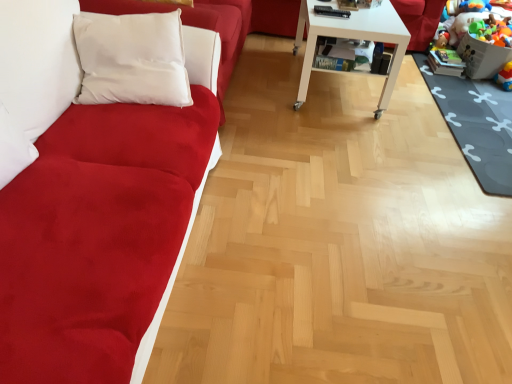
The image size is (512, 384). What do you see at coordinates (505, 77) in the screenshot?
I see `rubberized plastic toy at lower right, which appears as the first toy when ordered from the bottom` at bounding box center [505, 77].

The height and width of the screenshot is (384, 512). What do you see at coordinates (103, 231) in the screenshot? I see `suede-like red couch at left` at bounding box center [103, 231].

Identify the location of dark gray rubber mat at lower right. This screenshot has height=384, width=512. (476, 124).

This screenshot has height=384, width=512. I want to click on plush multicolored toys at lower right, acting as the 1th toy starting from the top, so click(481, 40).

Where is `white glossy table at center`? The image size is (512, 384). white glossy table at center is located at coordinates (352, 38).

This screenshot has width=512, height=384. I want to click on rubberized plastic toy at lower right, which is counted as the second toy, starting from the top, so click(x=505, y=77).

Considering the sizes of objects suede-like red couch at left and white glossy table at center in the image provided, who is bigger, suede-like red couch at left or white glossy table at center?

Bigger between the two is suede-like red couch at left.

Is suede-like red couch at left placed right next to white glossy table at center?

No, suede-like red couch at left is not next to white glossy table at center.

Which is behind, suede-like red couch at left or white glossy table at center?

white glossy table at center is more distant.

From a real-world perspective, is plush multicolored toys at lower right, acting as the second toy starting from the bottom, physically below dark gray rubber mat at lower right?

No.

Which object is closer to the camera, plush multicolored toys at lower right, acting as the 1th toy starting from the top, or dark gray rubber mat at lower right?

dark gray rubber mat at lower right is more forward.

Considering the relative sizes of plush multicolored toys at lower right, acting as the second toy starting from the bottom, and dark gray rubber mat at lower right in the image provided, is plush multicolored toys at lower right, acting as the second toy starting from the bottom, smaller than dark gray rubber mat at lower right?

Yes, plush multicolored toys at lower right, acting as the second toy starting from the bottom, is smaller than dark gray rubber mat at lower right.

Which object is thinner, plush multicolored toys at lower right, acting as the 1th toy starting from the top, or dark gray rubber mat at lower right?

plush multicolored toys at lower right, acting as the 1th toy starting from the top, is thinner.

Does dark gray rubber mat at lower right turn towards white glossy table at center?

No, dark gray rubber mat at lower right is not oriented towards white glossy table at center.

Looking at this image, from the image's perspective, between dark gray rubber mat at lower right and white glossy table at center, who is located below?

From the image's view, dark gray rubber mat at lower right is below.

Between dark gray rubber mat at lower right and white glossy table at center, which one has less height?

dark gray rubber mat at lower right is shorter.

Image resolution: width=512 pixels, height=384 pixels. Find the location of `mat below the white glossy table at center (from the image's perspective)`. mat below the white glossy table at center (from the image's perspective) is located at coordinates (476, 124).

From the image's perspective, is suede-like red couch at left below rubberized plastic toy at lower right, which appears as the first toy when ordered from the bottom?

Yes, from the image's perspective, suede-like red couch at left is below rubberized plastic toy at lower right, which appears as the first toy when ordered from the bottom.

Between suede-like red couch at left and rubberized plastic toy at lower right, which appears as the first toy when ordered from the bottom, which one has larger size?

suede-like red couch at left is bigger.

Considering the relative positions of suede-like red couch at left and rubberized plastic toy at lower right, which is counted as the second toy, starting from the top, in the image provided, is suede-like red couch at left behind rubberized plastic toy at lower right, which is counted as the second toy, starting from the top,?

No, suede-like red couch at left is in front of rubberized plastic toy at lower right, which is counted as the second toy, starting from the top.

How different are the orientations of plush multicolored toys at lower right, acting as the second toy starting from the bottom, and white glossy table at center in degrees?

17.2 degrees separate the facing orientations of plush multicolored toys at lower right, acting as the second toy starting from the bottom, and white glossy table at center.

Is plush multicolored toys at lower right, acting as the second toy starting from the bottom, in contact with white glossy table at center?

There is a gap between plush multicolored toys at lower right, acting as the second toy starting from the bottom, and white glossy table at center.

From a real-world perspective, is plush multicolored toys at lower right, acting as the 1th toy starting from the top, below white glossy table at center?

Indeed, from a real-world perspective, plush multicolored toys at lower right, acting as the 1th toy starting from the top, is positioned beneath white glossy table at center.

In the scene shown: Is plush multicolored toys at lower right, acting as the 1th toy starting from the top, touching suede-like red couch at left?

There is a gap between plush multicolored toys at lower right, acting as the 1th toy starting from the top, and suede-like red couch at left.

From the image's perspective, which one is positioned higher, plush multicolored toys at lower right, acting as the second toy starting from the bottom, or suede-like red couch at left?

From the image's view, plush multicolored toys at lower right, acting as the second toy starting from the bottom, is above.

Is plush multicolored toys at lower right, acting as the second toy starting from the bottom, inside the boundaries of suede-like red couch at left, or outside?

plush multicolored toys at lower right, acting as the second toy starting from the bottom, cannot be found inside suede-like red couch at left.

This screenshot has width=512, height=384. What are the coordinates of `toy that is the 1st object to the right of the suede-like red couch at left, starting at the anchor` in the screenshot? It's located at (481, 40).

Is white glossy table at center closer to camera compared to suede-like red couch at left?

No, it is not.

Is suede-like red couch at left a part of white glossy table at center?

No, suede-like red couch at left is not surrounded by white glossy table at center.

Is point (367, 39) behind point (130, 298)?

Yes, it is behind point (130, 298).

Where is `studio couch below the white glossy table at center (from the image's perspective)`? This screenshot has width=512, height=384. studio couch below the white glossy table at center (from the image's perspective) is located at coordinates (103, 231).

This screenshot has width=512, height=384. I want to click on studio couch below the white glossy table at center (from the image's perspective), so click(103, 231).

Where is `the 2nd toy above the dark gray rubber mat at lower right (from the image's perspective)`? Image resolution: width=512 pixels, height=384 pixels. the 2nd toy above the dark gray rubber mat at lower right (from the image's perspective) is located at coordinates (481, 40).

Looking at the image, which one is located closer to white glossy table at center, dark gray rubber mat at lower right or rubberized plastic toy at lower right, which appears as the first toy when ordered from the bottom?

dark gray rubber mat at lower right is closer to white glossy table at center.

Looking at the image, which one is located further to plush multicolored toys at lower right, acting as the 1th toy starting from the top, dark gray rubber mat at lower right or suede-like red couch at left?

Based on the image, suede-like red couch at left appears to be further to plush multicolored toys at lower right, acting as the 1th toy starting from the top.

Considering their positions, is plush multicolored toys at lower right, acting as the 1th toy starting from the top, positioned further to dark gray rubber mat at lower right than white glossy table at center?

white glossy table at center lies further to dark gray rubber mat at lower right than the other object.

Considering their positions, is white glossy table at center positioned closer to dark gray rubber mat at lower right than suede-like red couch at left?

Among the two, white glossy table at center is located nearer to dark gray rubber mat at lower right.

Based on the photo, based on their spatial positions, is rubberized plastic toy at lower right, which is counted as the second toy, starting from the top, or suede-like red couch at left further from white glossy table at center?

Among the two, suede-like red couch at left is located further to white glossy table at center.

Considering their positions, is rubberized plastic toy at lower right, which is counted as the second toy, starting from the top, positioned closer to dark gray rubber mat at lower right than white glossy table at center?

Based on the image, rubberized plastic toy at lower right, which is counted as the second toy, starting from the top, appears to be nearer to dark gray rubber mat at lower right.

From the image, which object appears to be farther from rubberized plastic toy at lower right, which is counted as the second toy, starting from the top, suede-like red couch at left or plush multicolored toys at lower right, acting as the second toy starting from the bottom?

suede-like red couch at left.

When comparing their distances from suede-like red couch at left, does plush multicolored toys at lower right, acting as the 1th toy starting from the top, or dark gray rubber mat at lower right seem closer?

Based on the image, dark gray rubber mat at lower right appears to be nearer to suede-like red couch at left.

The height and width of the screenshot is (384, 512). In order to click on table located between suede-like red couch at left and dark gray rubber mat at lower right in the left-right direction in this screenshot , I will do `click(352, 38)`.

You are a GUI agent. You are given a task and a screenshot of the screen. Output one action in this format:
    pyautogui.click(x=<x>, y=<y>)
    Task: Click on the toy between white glossy table at center and rubberized plastic toy at lower right, which appears as the first toy when ordered from the bottom, from left to right
    The image size is (512, 384).
    Given the screenshot: What is the action you would take?
    pyautogui.click(x=481, y=40)

You are a GUI agent. You are given a task and a screenshot of the screen. Output one action in this format:
    pyautogui.click(x=<x>, y=<y>)
    Task: Click on the mat located between white glossy table at center and plush multicolored toys at lower right, acting as the second toy starting from the bottom, in the left-right direction
    This screenshot has width=512, height=384.
    Given the screenshot: What is the action you would take?
    pyautogui.click(x=476, y=124)

Locate an element on the screen. The width and height of the screenshot is (512, 384). table between suede-like red couch at left and rubberized plastic toy at lower right, which is counted as the second toy, starting from the top, from front to back is located at coordinates (352, 38).